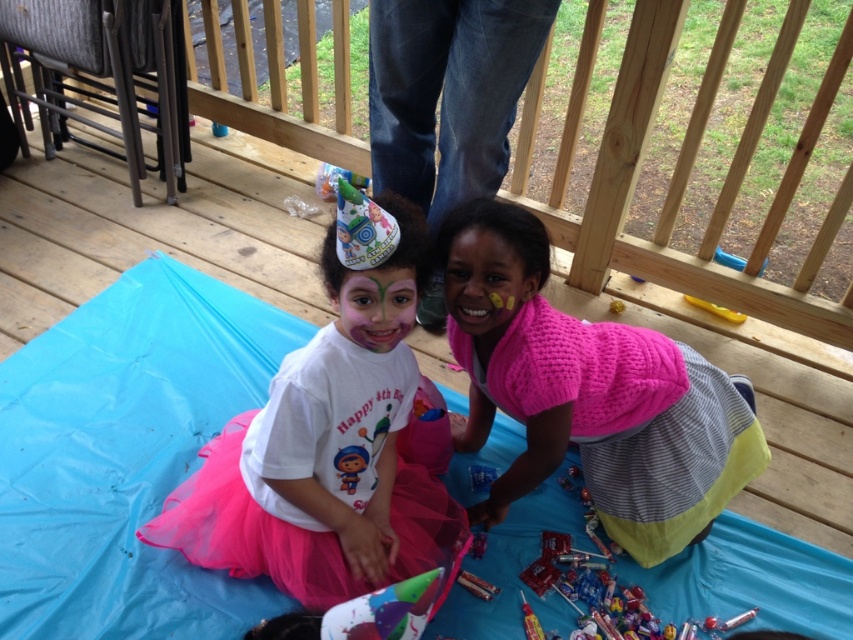
Question: Which of the following is the closest to the observer?

Choices:
 (A) (614, 304)
 (B) (393, 550)
 (C) (473, 556)
 (D) (717, 248)

Answer: (B)

Question: Observing the image, what is the correct spatial positioning of metallic silver toy at lower center in reference to rubberized plastic toy at lower center?

Choices:
 (A) above
 (B) below

Answer: (B)

Question: Does rubberized plastic toy at lower center have a larger size compared to yellow rubber ball at center?

Choices:
 (A) no
 (B) yes

Answer: (A)

Question: Can you confirm if white matte t-shirt at center is positioned below yellow plastic spoon at lower right?

Choices:
 (A) no
 (B) yes

Answer: (B)

Question: Based on their relative distances, which object is nearer to the blue plastic toy at lower center?

Choices:
 (A) pink knitted vest at center
 (B) blue plastic toy at upper right

Answer: (A)

Question: Which object is farther from the camera taking this photo?

Choices:
 (A) blue plastic toy at lower center
 (B) yellow rubber ball at center
 (C) white matte t-shirt at center

Answer: (B)